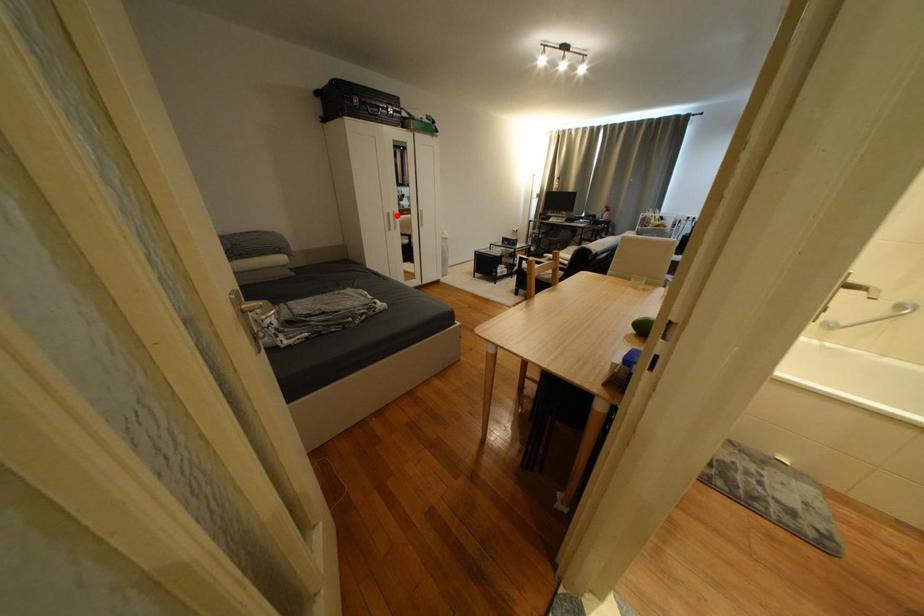
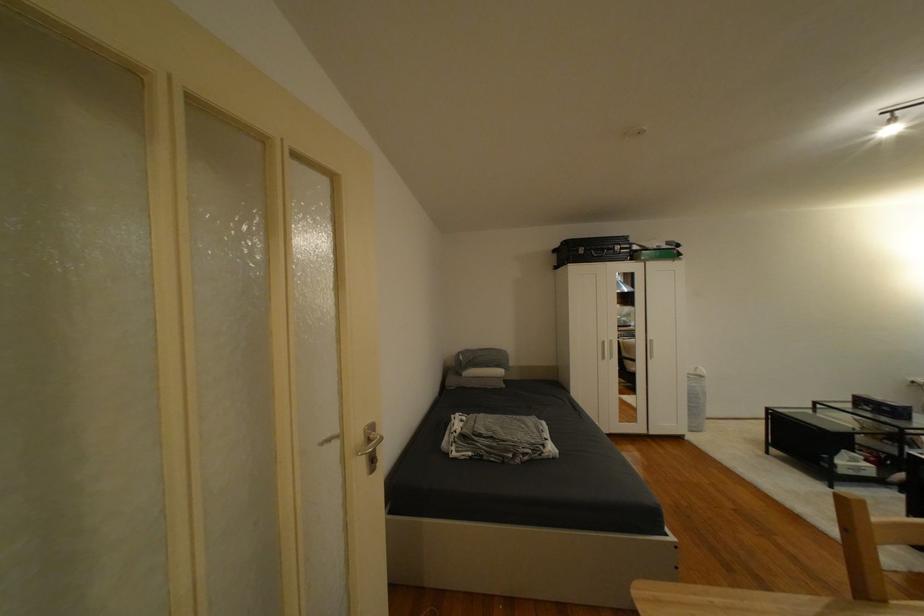
Question: A red point is marked in image1. In image2, is the corresponding 3D point closer to the camera or farther? Reply with the corresponding letter.

Choices:
 (A) The corresponding 3D point is closer.
 (B) The corresponding 3D point is farther.

Answer: (B)